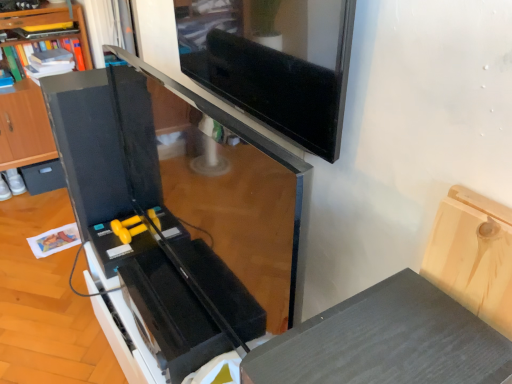
Question: Relative to black matte drawer at lower left, is black matte shelf at left in front or behind?

Choices:
 (A) behind
 (B) front

Answer: (B)

Question: Looking at the image, does black matte shelf at left seem bigger or smaller compared to black matte drawer at lower left?

Choices:
 (A) big
 (B) small

Answer: (A)

Question: Is black matte shelf at left situated inside black matte drawer at lower left or outside?

Choices:
 (A) inside
 (B) outside

Answer: (B)

Question: Choose the correct answer: Is black matte drawer at lower left inside black matte shelf at left or outside it?

Choices:
 (A) outside
 (B) inside

Answer: (B)

Question: Considering the positions of black matte drawer at lower left and black matte shelf at left in the image, is black matte drawer at lower left bigger or smaller than black matte shelf at left?

Choices:
 (A) small
 (B) big

Answer: (A)

Question: Considering the positions of point (61, 180) and point (30, 92), is point (61, 180) closer or farther from the camera than point (30, 92)?

Choices:
 (A) farther
 (B) closer

Answer: (A)

Question: Considering their positions, is black matte drawer at lower left located in front of or behind black matte shelf at left?

Choices:
 (A) behind
 (B) front

Answer: (A)